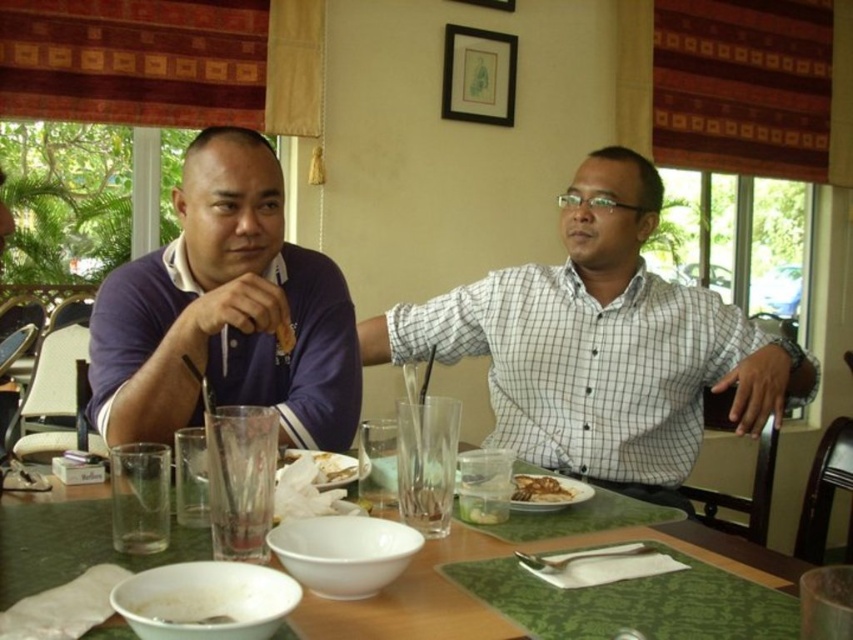
Which of these two, white checkered shirt at center or white matte bowl at lower left, stands taller?

white checkered shirt at center

Consider the image. Who is shorter, white checkered shirt at center or white matte bowl at lower left?

Standing shorter between the two is white matte bowl at lower left.

Who is more forward, [762,348] or [263,589]?

Positioned in front is point [263,589].

Where is `white checkered shirt at center`? white checkered shirt at center is located at coordinates (602, 346).

Between green textured table at center and white paper napkin at center, which one has more height?

green textured table at center is taller.

Measure the distance between green textured table at center and camera.

A distance of 26.25 inches exists between green textured table at center and camera.

Who is more distant from viewer, (3, 547) or (283, 460)?

Positioned behind is point (283, 460).

You are a GUI agent. You are given a task and a screenshot of the screen. Output one action in this format:
    pyautogui.click(x=<x>, y=<y>)
    Task: Click on the green textured table at center
    
    Given the screenshot: What is the action you would take?
    pyautogui.click(x=70, y=545)

Can you confirm if green textured table at center is positioned above brown matte plate at center?

Actually, green textured table at center is below brown matte plate at center.

Which is below, green textured table at center or brown matte plate at center?

Positioned lower is green textured table at center.

In order to click on green textured table at center in this screenshot , I will do `click(70, 545)`.